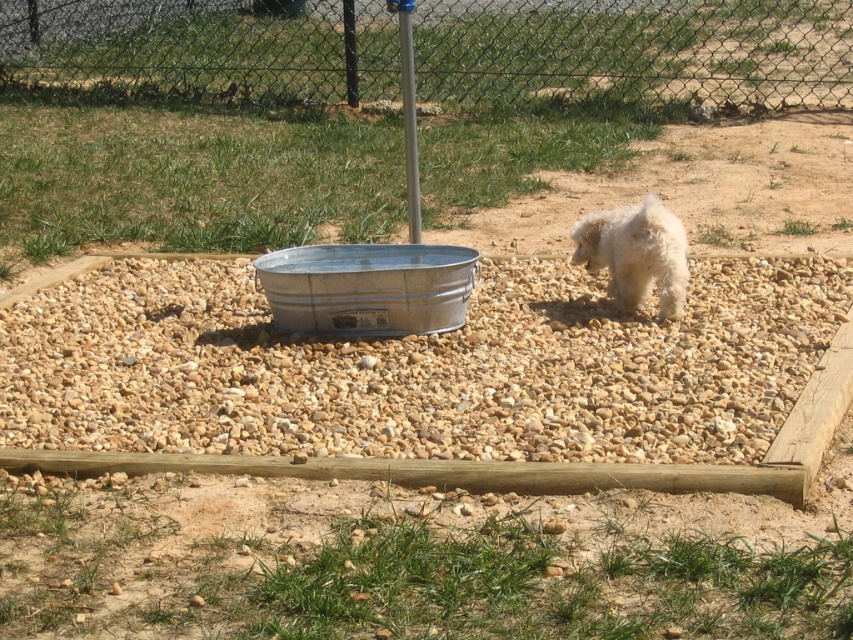
Question: Does metal mesh fence at upper center have a lesser width compared to white fluffy dog at right?

Choices:
 (A) no
 (B) yes

Answer: (A)

Question: Among these points, which one is nearest to the camera?

Choices:
 (A) (7, 45)
 (B) (637, 305)
 (C) (422, 308)

Answer: (C)

Question: Which point appears farthest from the camera in this image?

Choices:
 (A) (686, 246)
 (B) (432, 20)
 (C) (492, 355)

Answer: (B)

Question: Among these points, which one is nearest to the camera?

Choices:
 (A) (398, 292)
 (B) (846, 92)

Answer: (A)

Question: Can you confirm if gray gravel at center is positioned to the right of white fluffy dog at right?

Choices:
 (A) no
 (B) yes

Answer: (A)

Question: Does gray gravel at center have a smaller size compared to metal mesh fence at upper center?

Choices:
 (A) yes
 (B) no

Answer: (A)